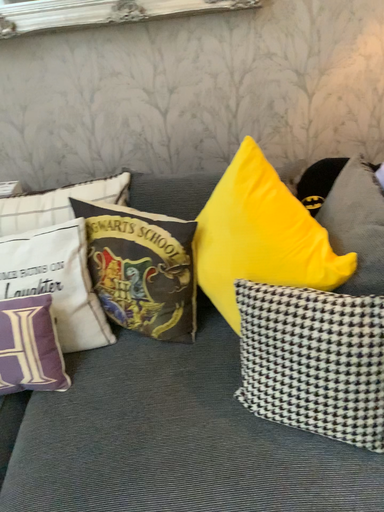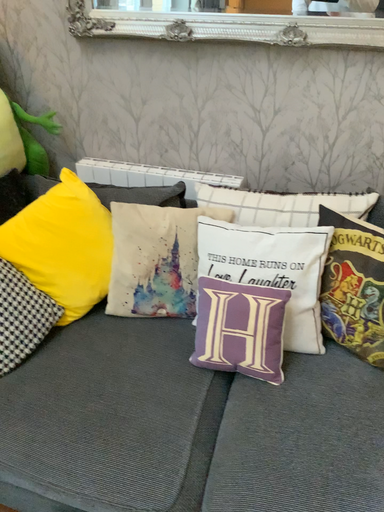
Question: How did the camera likely rotate when shooting the video?

Choices:
 (A) rotated left
 (B) rotated right

Answer: (A)